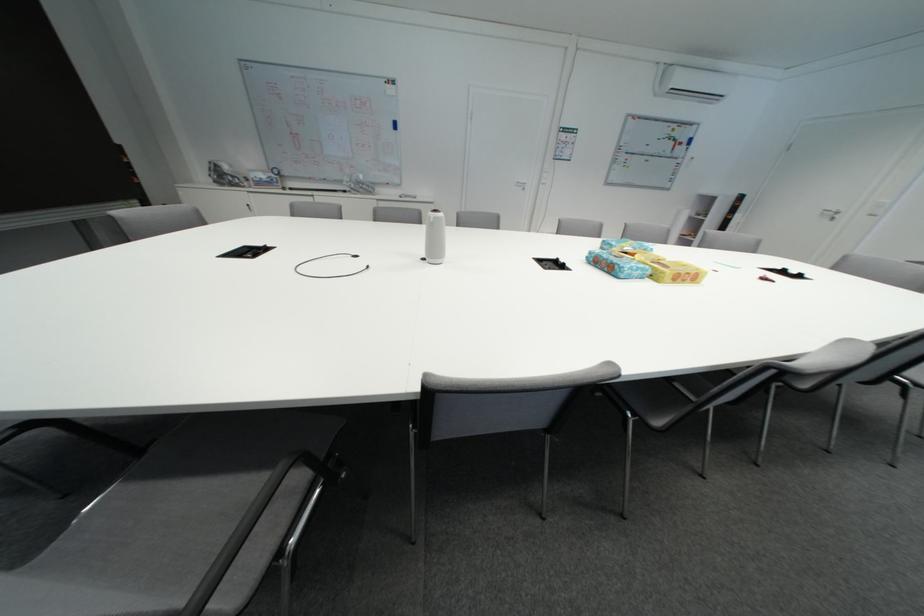
Find the location of a particular element. This screenshot has width=924, height=616. grey chair sitting surface is located at coordinates (176, 513).